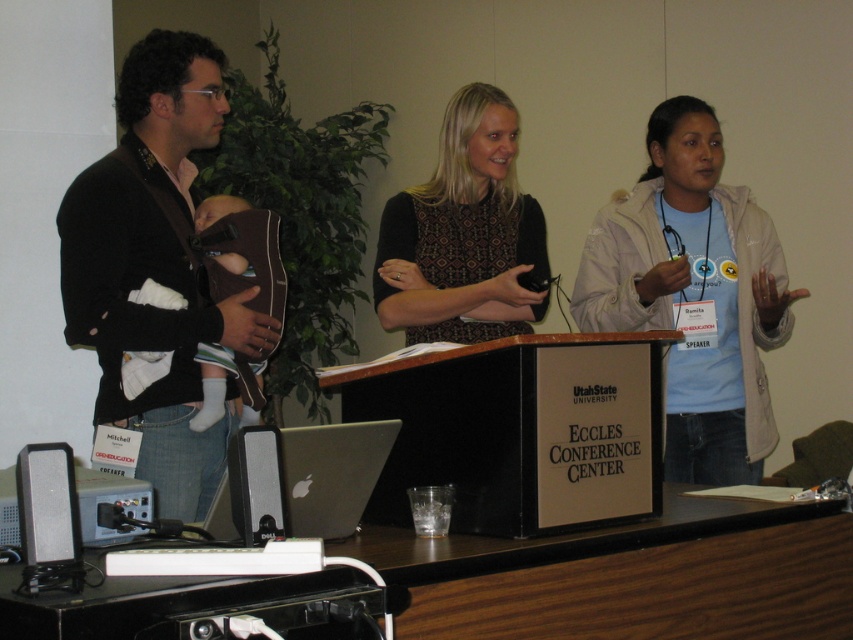
Question: Which point appears farthest from the camera in this image?

Choices:
 (A) (149, 88)
 (B) (403, 577)

Answer: (A)

Question: Which of the following is the closest to the observer?

Choices:
 (A) black plastic speaker at lower left
 (B) wooden table at lower center
 (C) light beige jacket at center
 (D) silver metallic speaker at lower left

Answer: (B)

Question: Can you confirm if wooden table at lower center is positioned above black plastic speaker at lower left?

Choices:
 (A) no
 (B) yes

Answer: (A)

Question: Estimate the real-world distances between objects in this image. Which object is farther from the wooden table at lower center?

Choices:
 (A) silver metallic speaker at lower left
 (B) black textured dress at center

Answer: (B)

Question: Does brown leather baby carrier at left have a lesser width compared to black plastic speaker at lower left?

Choices:
 (A) yes
 (B) no

Answer: (B)

Question: Considering the relative positions of light beige jacket at center and black textured dress at center in the image provided, where is light beige jacket at center located with respect to black textured dress at center?

Choices:
 (A) below
 (B) above

Answer: (A)